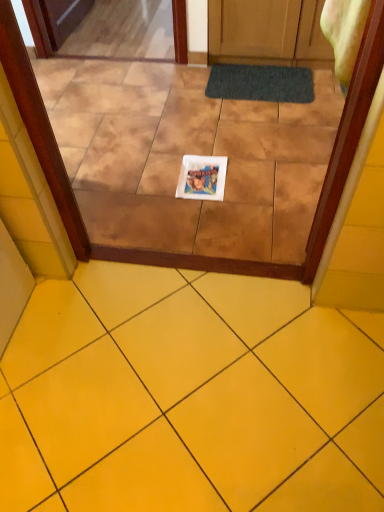
You are a GUI agent. You are given a task and a screenshot of the screen. Output one action in this format:
    pyautogui.click(x=<x>, y=<y>)
    Task: Click on the free space in front of white paper at center
    This screenshot has width=384, height=512.
    Given the screenshot: What is the action you would take?
    pyautogui.click(x=204, y=215)